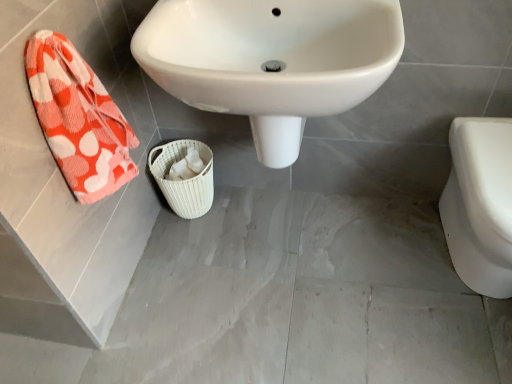
Image resolution: width=512 pixels, height=384 pixels. What are the coordinates of `vacant space in between white glossy toilet at right and white woven basket at center` in the screenshot? It's located at (326, 236).